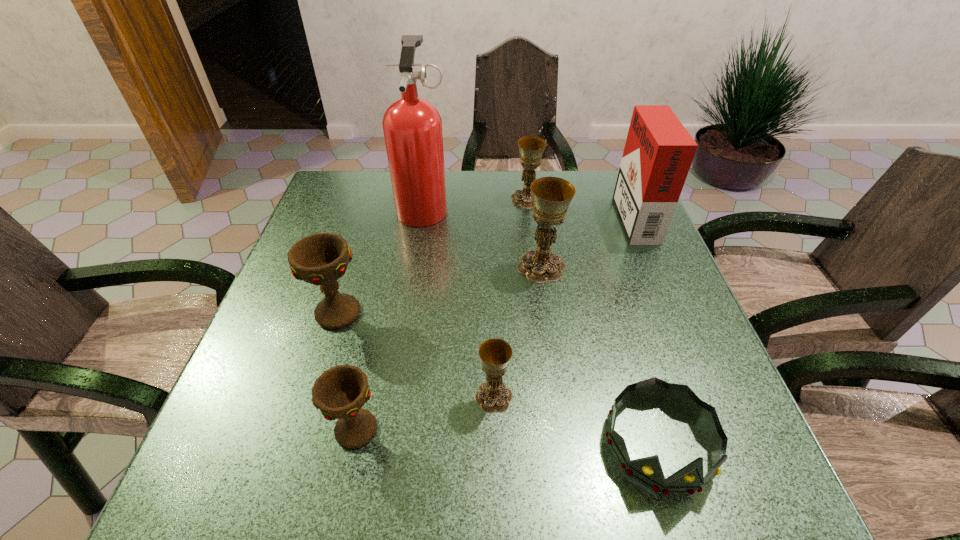
I want to click on free spot between the red cigarette case and the fifth object from right to left, so click(x=564, y=306).

This screenshot has width=960, height=540. I want to click on free space that is in between the third chalice from left to right and the cigarette case, so click(564, 306).

Where is `free space between the cigarette case and the nearest gold chalice`? The height and width of the screenshot is (540, 960). free space between the cigarette case and the nearest gold chalice is located at coordinates (564, 306).

Locate an element on the screen. free spot between the second farthest gold chalice and the tallest object is located at coordinates (483, 237).

The image size is (960, 540). I want to click on blank region between the fire extinguisher and the red tiara, so click(x=541, y=325).

This screenshot has width=960, height=540. In order to click on empty space between the seventh shortest object and the biggest gold chalice in this screenshot , I will do `click(588, 241)`.

Where is `unoccupied position between the red tiara and the second tallest object`? Image resolution: width=960 pixels, height=540 pixels. unoccupied position between the red tiara and the second tallest object is located at coordinates (646, 329).

The width and height of the screenshot is (960, 540). What are the coordinates of `free space that is in between the farther red chalice and the second biggest gold chalice` in the screenshot? It's located at (432, 256).

Locate an element on the screen. unoccupied position between the fourth object from left to right and the farthest chalice is located at coordinates (511, 298).

At what (x,y) coordinates should I click in order to perform the action: click on object that is the third nearest to the nearer red chalice. Please return your answer as a coordinate pair (x, y). The height and width of the screenshot is (540, 960). Looking at the image, I should click on (648, 471).